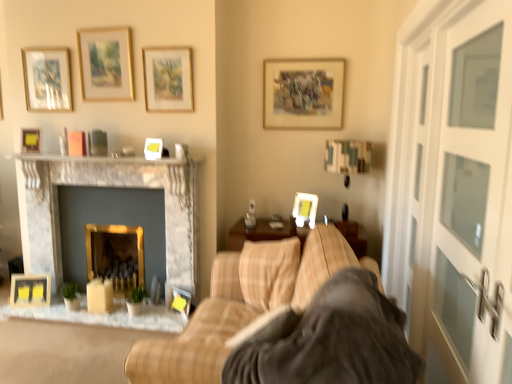
Question: Is matte wooden picture frame at lower left, the 10th picture frame when ordered from right to left, not near matte white picture frame at upper right, arranged as the first picture frame when viewed from the right?

Choices:
 (A) no
 (B) yes

Answer: (B)

Question: Is matte wooden picture frame at lower left, the 10th picture frame when ordered from right to left, positioned with its back to matte white picture frame at upper right, the tenth picture frame from the left?

Choices:
 (A) yes
 (B) no

Answer: (B)

Question: Considering the relative sizes of matte wooden picture frame at lower left, the 10th picture frame when ordered from right to left, and matte white picture frame at upper right, arranged as the first picture frame when viewed from the right, in the image provided, is matte wooden picture frame at lower left, the 10th picture frame when ordered from right to left, thinner than matte white picture frame at upper right, arranged as the first picture frame when viewed from the right,?

Choices:
 (A) no
 (B) yes

Answer: (A)

Question: From a real-world perspective, is matte wooden picture frame at lower left, the 10th picture frame when ordered from right to left, on top of matte white picture frame at upper right, arranged as the first picture frame when viewed from the right?

Choices:
 (A) yes
 (B) no

Answer: (B)

Question: Is matte white picture frame at upper right, the tenth picture frame from the left, surrounded by matte wooden picture frame at lower left, the 10th picture frame when ordered from right to left?

Choices:
 (A) no
 (B) yes

Answer: (A)

Question: Is matte wooden picture frame at lower left, the 10th picture frame when ordered from right to left, positioned beyond the bounds of matte white picture frame at upper right, the tenth picture frame from the left?

Choices:
 (A) no
 (B) yes

Answer: (B)

Question: From the image's perspective, would you say wooden picture frame at center, which is the fifth picture frame from left to right, is shown under matte glass picture frame at upper left, arranged as the third picture frame when viewed from the left?

Choices:
 (A) yes
 (B) no

Answer: (A)

Question: Does wooden picture frame at center, the 6th picture frame from the right, appear on the right side of matte glass picture frame at upper left, arranged as the third picture frame when viewed from the left?

Choices:
 (A) yes
 (B) no

Answer: (A)

Question: Is wooden picture frame at center, which is the fifth picture frame from left to right, with matte glass picture frame at upper left, the 8th picture frame when ordered from right to left?

Choices:
 (A) no
 (B) yes

Answer: (A)

Question: Is the position of wooden picture frame at center, the 6th picture frame from the right, less distant than that of matte glass picture frame at upper left, arranged as the third picture frame when viewed from the left?

Choices:
 (A) yes
 (B) no

Answer: (B)

Question: Can you confirm if wooden picture frame at center, which is the fifth picture frame from left to right, is taller than matte glass picture frame at upper left, the 8th picture frame when ordered from right to left?

Choices:
 (A) yes
 (B) no

Answer: (B)

Question: Can you confirm if wooden picture frame at center, which is the fifth picture frame from left to right, is smaller than matte glass picture frame at upper left, the 8th picture frame when ordered from right to left?

Choices:
 (A) no
 (B) yes

Answer: (B)

Question: Is matte black picture frame at lower center, which is counted as the 3th picture frame, starting from the right, at the left side of marble fireplace at center, which is counted as the second fireplace, starting from the right?

Choices:
 (A) no
 (B) yes

Answer: (A)